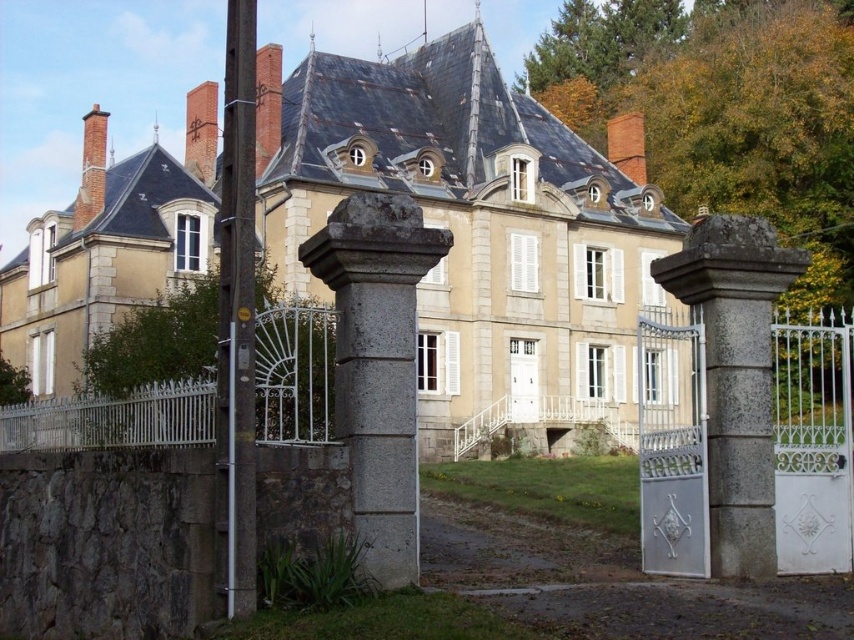
You are standing at the entrance of the house and see the gray stone gate at center and the brown wooden pole at left. Which object is positioned to the right of the other?

The gray stone gate at center is to the right of the brown wooden pole at left.

You are standing at the entrance of the property and looking towards the beige stone mansion at center and the gray stone gate at center. Which object is positioned higher in your field of view?

The beige stone mansion at center is positioned higher in your field of view than the gray stone gate at center because it is above it.